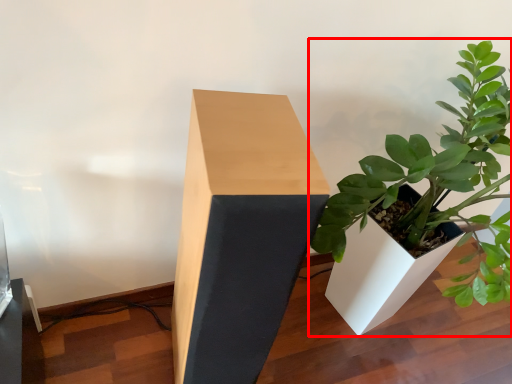
Question: From the image's perspective, considering the relative positions of houseplant (annotated by the red box) and table in the image provided, where is houseplant (annotated by the red box) located with respect to the staircase?

Choices:
 (A) above
 (B) below

Answer: (A)